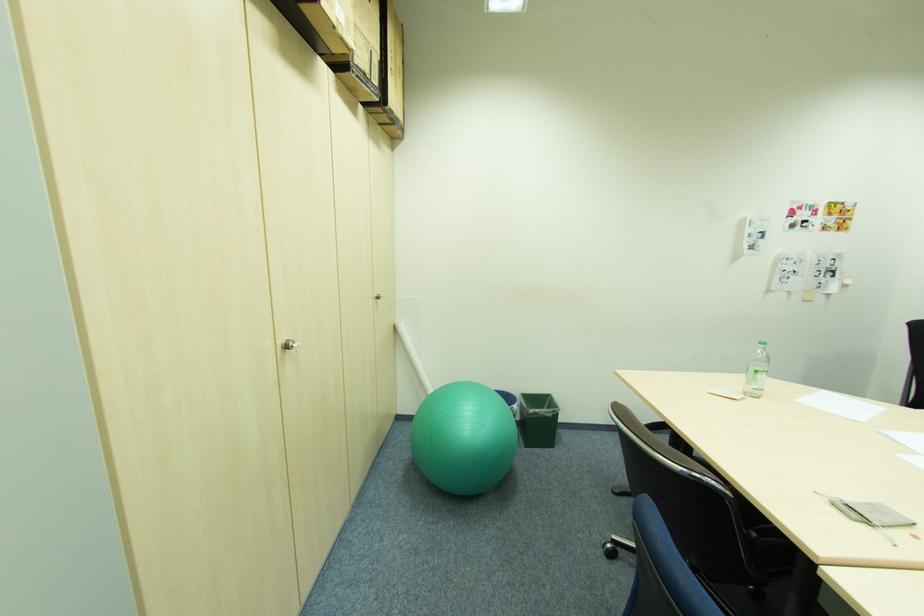
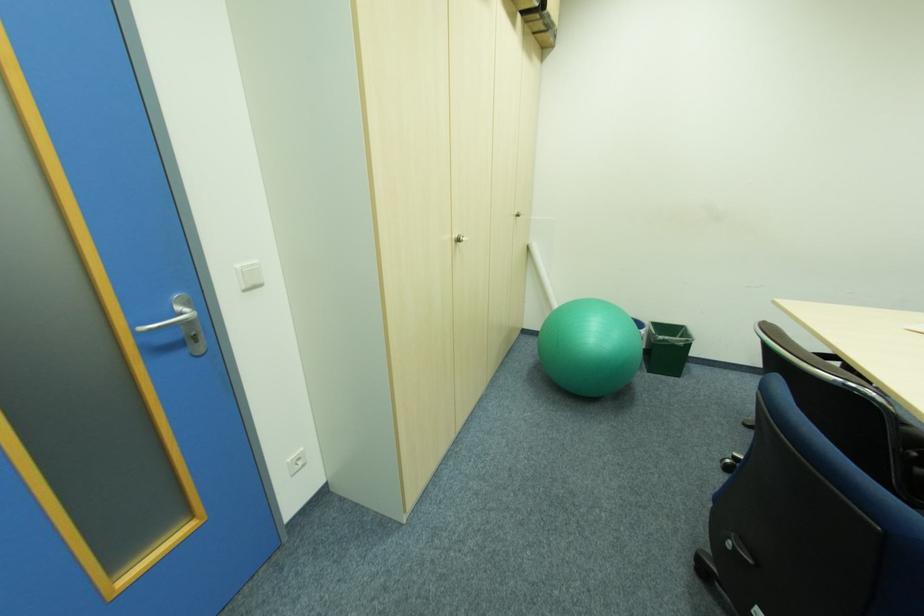
The point at (293, 347) is marked in the first image. Where is the corresponding point in the second image?

(464, 241)